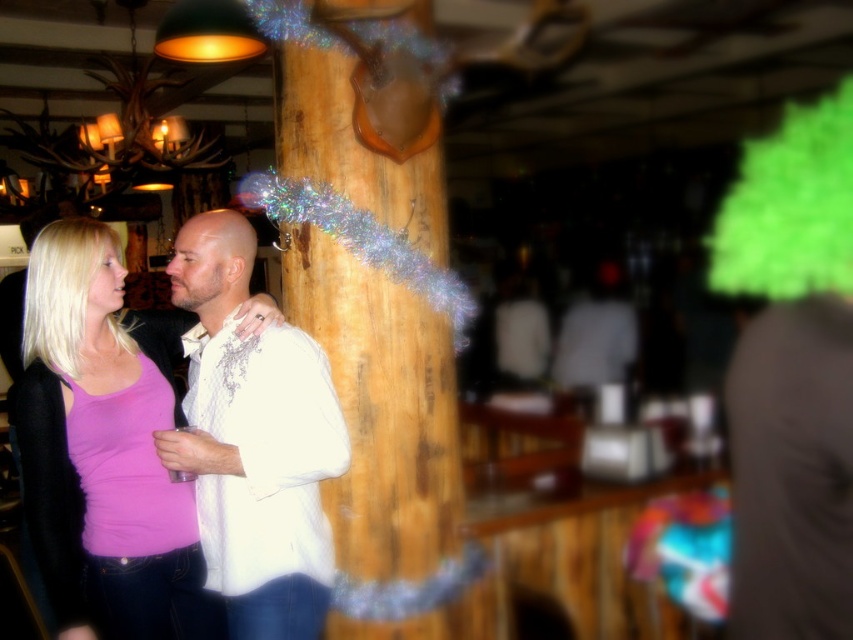
You are a photographer standing at the center of the room. You want to take a photo that includes both the white satin shirt at center and the green fuzzy wig at upper right. Given that your camera has a maximum focus range of 4 meters, will both subjects be in focus?

The white satin shirt at center is 4.59 meters away from the green fuzzy wig at upper right. Since the distance between them exceeds the camera maximum focus range of 4 meters, both subjects cannot be in focus simultaneously.

You are a fashion designer observing the scene. You notice the pink fabric tank top at center and the blonde hair at left. Which of these two items appears to be bigger in size?

The pink fabric tank top at center has a larger size compared to the blonde hair at left.